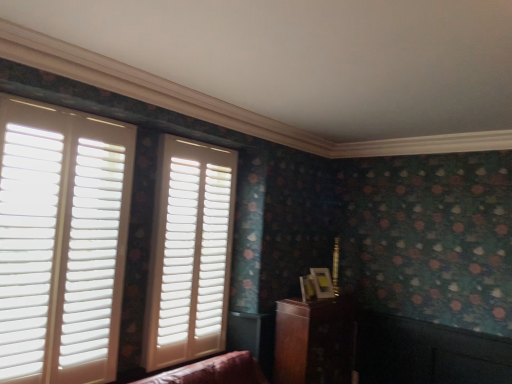
Question: Considering the relative positions of wooden cabinet at lower right and white matte shutters at center, which appears as the 1th window when viewed from the back, in the image provided, is wooden cabinet at lower right to the left or to the right of white matte shutters at center, which appears as the 1th window when viewed from the back,?

Choices:
 (A) left
 (B) right

Answer: (B)

Question: Considering the positions of wooden cabinet at lower right and white matte shutters at center, positioned as the second window in left-to-right order, in the image, is wooden cabinet at lower right bigger or smaller than white matte shutters at center, positioned as the second window in left-to-right order,?

Choices:
 (A) big
 (B) small

Answer: (A)

Question: Based on their relative distances, which object is nearer to the white matte shutters at left, placed as the 2th window when sorted from right to left?

Choices:
 (A) wooden cabinet at lower right
 (B) white matte shutters at center, positioned as the second window in left-to-right order

Answer: (B)

Question: Estimate the real-world distances between objects in this image. Which object is closer to the white matte shutters at left, placed as the 2th window when sorted from right to left?

Choices:
 (A) wooden cabinet at lower right
 (B) white matte shutters at center, which is counted as the first window, starting from the right

Answer: (B)